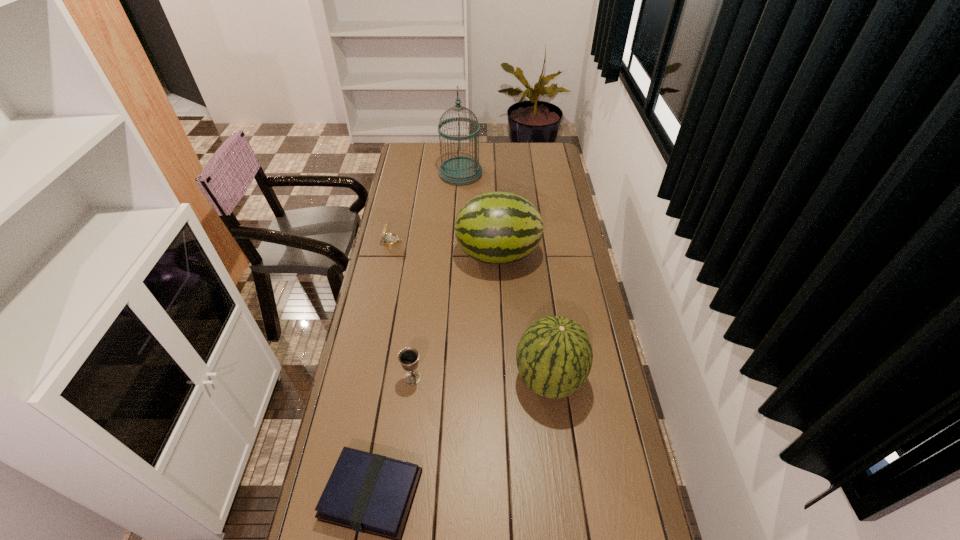
Identify the location of free space located on the back of the nearer watermelon. The image size is (960, 540). click(x=538, y=288).

Image resolution: width=960 pixels, height=540 pixels. I want to click on vacant area situated on the back of the third shortest object, so click(421, 305).

Locate an element on the screen. The image size is (960, 540). free location located with the dial facing the compass is located at coordinates (471, 241).

The height and width of the screenshot is (540, 960). I want to click on object located at the far edge, so click(460, 170).

The height and width of the screenshot is (540, 960). Identify the location of object that is at the left edge. (390, 239).

The image size is (960, 540). I want to click on object present at the right edge, so click(554, 356).

Where is `free location at the far edge`? The width and height of the screenshot is (960, 540). free location at the far edge is located at coordinates (514, 152).

Locate an element on the screen. The width and height of the screenshot is (960, 540). vacant space at the left edge of the desktop is located at coordinates (379, 247).

Find the location of a particular element. vacant area at the right edge of the desktop is located at coordinates (591, 514).

Where is `free space at the far left corner of the desktop`? This screenshot has height=540, width=960. free space at the far left corner of the desktop is located at coordinates (403, 159).